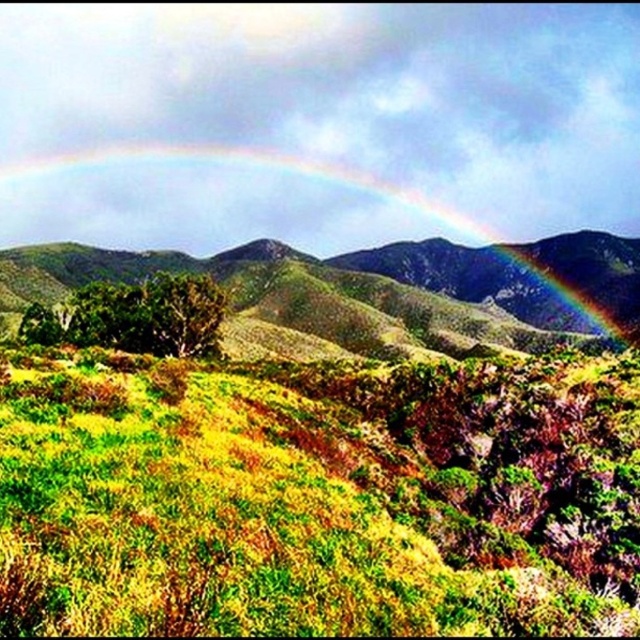
You are standing in the landscape and want to take a photo of the rainbow at upper center. Which direction should you face to ensure the green grassy at center is not blocking your view?

To avoid the green grassy at center blocking your view of the rainbow at upper center, you should look upward since the rainbow at upper center is above the green grassy at center.